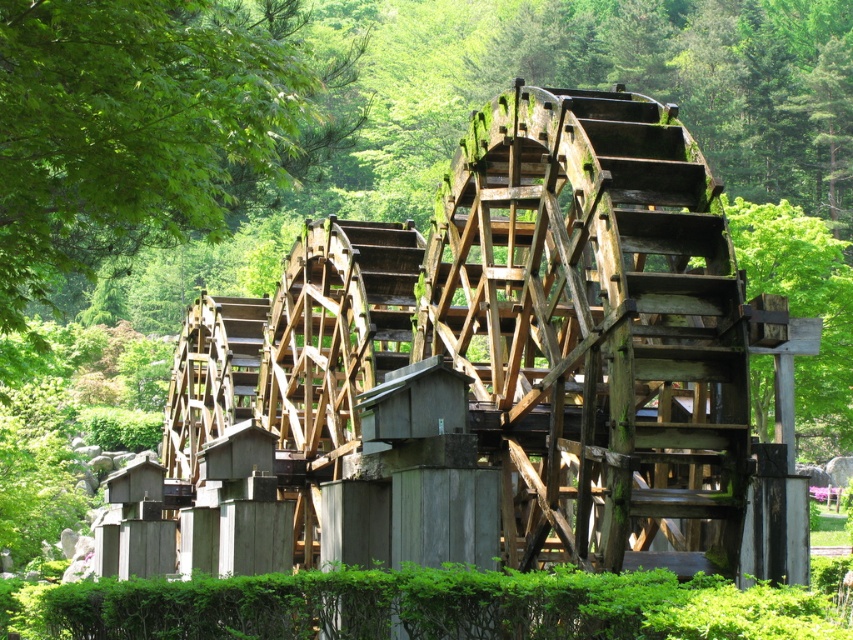
Between green leafy tree at upper left and wooden waterwheel at center, which one appears on the right side from the viewer's perspective?

wooden waterwheel at center is more to the right.

Is green leafy tree at upper left above wooden waterwheel at center?

Correct, green leafy tree at upper left is located above wooden waterwheel at center.

Identify the location of green leafy tree at upper left. (149, 125).

The width and height of the screenshot is (853, 640). What are the coordinates of `green leafy tree at upper left` in the screenshot? It's located at (149, 125).